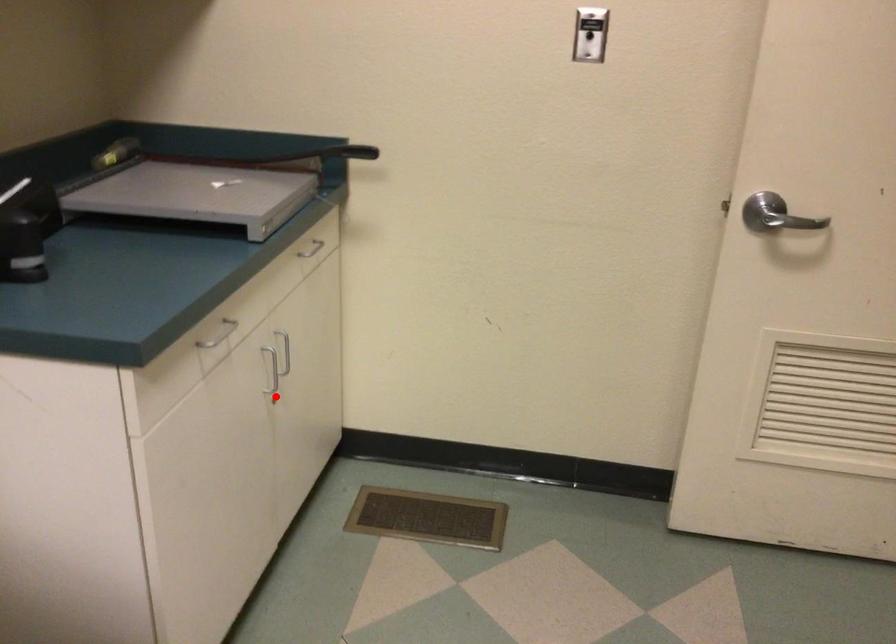
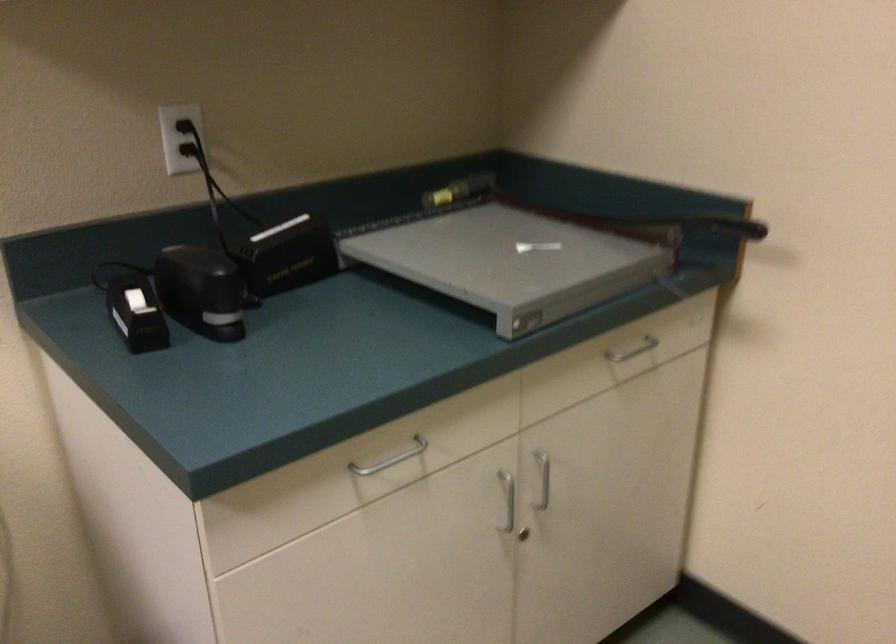
In the second image, find the point that corresponds to the highlighted location in the first image.

(522, 534)